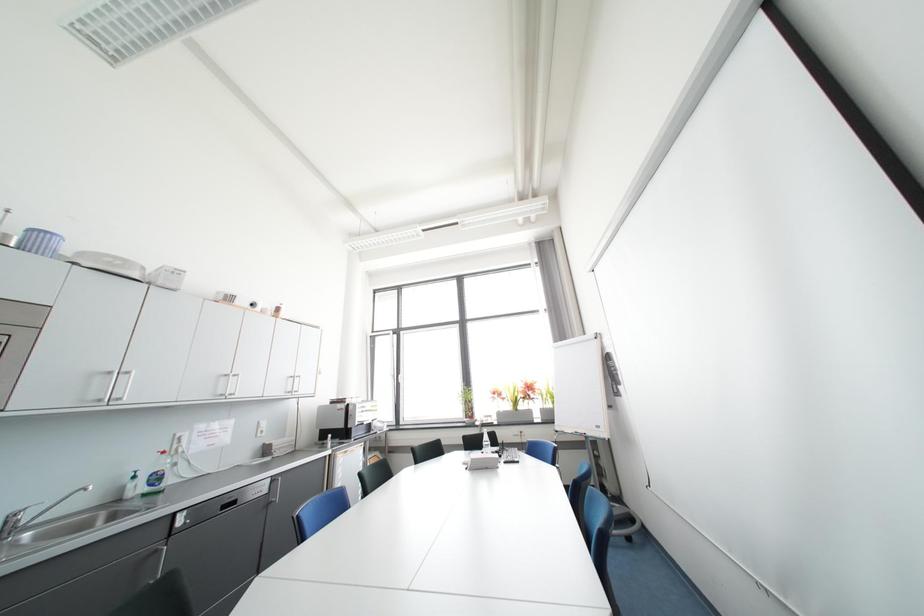
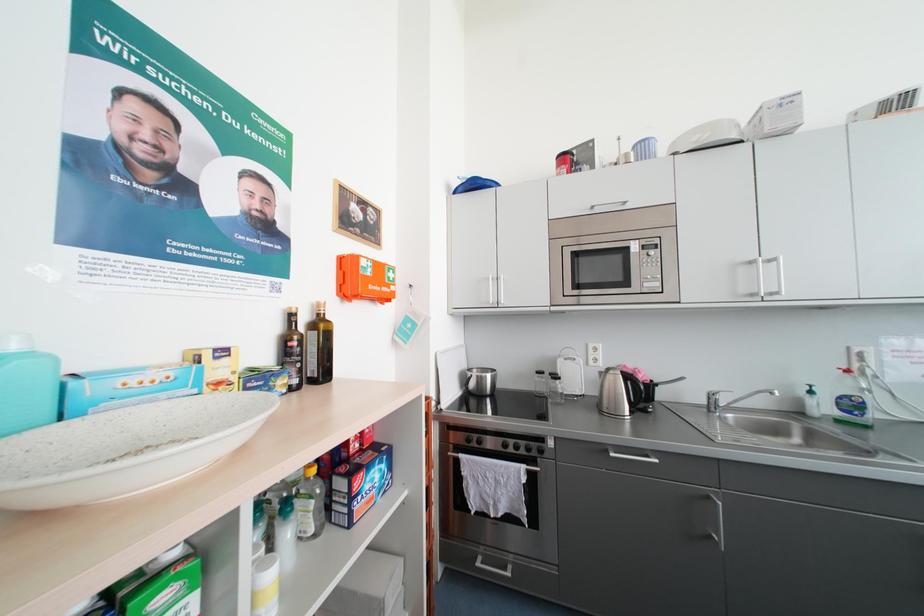
Question: The images are taken continuously from a first-person perspective. In which direction is your viewpoint rotating?

Choices:
 (A) Left
 (B) Right
 (C) Up
 (D) Down

Answer: (A)